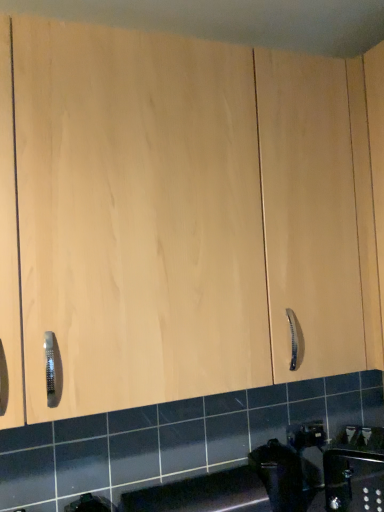
Question: Should I look upward or downward to see black plastic trash can at lower center?

Choices:
 (A) up
 (B) down

Answer: (B)

Question: Would you say black plastic trash can at lower center contains satin nickel faucet at lower right?

Choices:
 (A) yes
 (B) no

Answer: (B)

Question: From a real-world perspective, is black plastic trash can at lower center located higher than satin nickel faucet at lower right?

Choices:
 (A) yes
 (B) no

Answer: (A)

Question: Is black plastic trash can at lower center not close to satin nickel faucet at lower right?

Choices:
 (A) no
 (B) yes

Answer: (A)

Question: Does black plastic trash can at lower center have a lesser height compared to satin nickel faucet at lower right?

Choices:
 (A) no
 (B) yes

Answer: (A)

Question: Can you confirm if black plastic trash can at lower center is positioned to the right of satin nickel faucet at lower right?

Choices:
 (A) yes
 (B) no

Answer: (B)

Question: Is black plastic trash can at lower center facing away from satin nickel faucet at lower right?

Choices:
 (A) no
 (B) yes

Answer: (A)

Question: Does satin nickel faucet at lower right have a larger size compared to black plastic trash can at lower center?

Choices:
 (A) no
 (B) yes

Answer: (B)

Question: Is satin nickel faucet at lower right smaller than black plastic trash can at lower center?

Choices:
 (A) yes
 (B) no

Answer: (B)

Question: From a real-world perspective, does satin nickel faucet at lower right sit lower than black plastic trash can at lower center?

Choices:
 (A) yes
 (B) no

Answer: (A)

Question: Is satin nickel faucet at lower right at the left side of black plastic trash can at lower center?

Choices:
 (A) no
 (B) yes

Answer: (A)

Question: Is satin nickel faucet at lower right looking in the opposite direction of black plastic trash can at lower center?

Choices:
 (A) yes
 (B) no

Answer: (B)

Question: Would you say black plastic trash can at lower center is part of satin nickel faucet at lower right's contents?

Choices:
 (A) no
 (B) yes

Answer: (A)

Question: From the image's perspective, is black plastic trash can at lower center positioned above or below satin nickel faucet at lower right?

Choices:
 (A) below
 (B) above

Answer: (A)